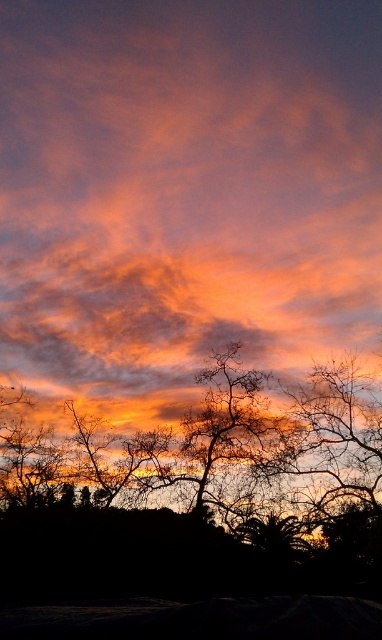
Question: Can you confirm if cloudy orange sky at center is bigger than silhouette leafless tree at bottom?

Choices:
 (A) yes
 (B) no

Answer: (A)

Question: Among these objects, which one is nearest to the camera?

Choices:
 (A) cloudy orange sky at center
 (B) silhouette leafless tree at bottom

Answer: (B)

Question: Estimate the real-world distances between objects in this image. Which object is farther from the green leafy tree at lower center?

Choices:
 (A) cloudy orange sky at center
 (B) silhouette leafless tree at bottom

Answer: (A)

Question: Is cloudy orange sky at center bigger than green leafy tree at lower center?

Choices:
 (A) no
 (B) yes

Answer: (B)

Question: Can you confirm if cloudy orange sky at center is thinner than silhouette leafless tree at bottom?

Choices:
 (A) no
 (B) yes

Answer: (A)

Question: Which object is the closest to the silhouette leafless tree at bottom?

Choices:
 (A) green leafy tree at lower center
 (B) cloudy orange sky at center

Answer: (A)